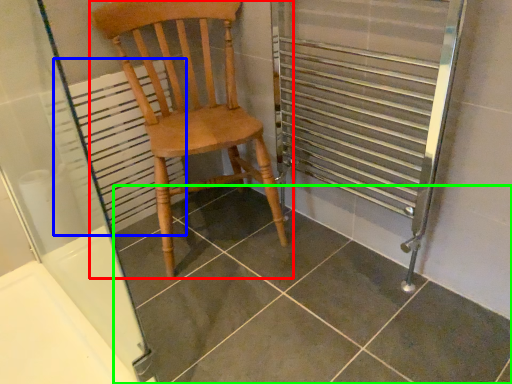
Question: Estimate the real-world distances between objects in this image. Which object is farther from chair (highlighted by a red box), radiator (highlighted by a blue box) or tile (highlighted by a green box)?

Choices:
 (A) radiator
 (B) tile

Answer: (B)